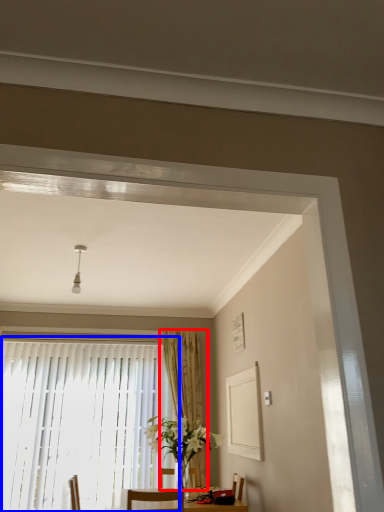
Question: Which of the following is the closest to the observer, curtain (highlighted by a red box) or window (highlighted by a blue box)?

Choices:
 (A) curtain
 (B) window

Answer: (B)